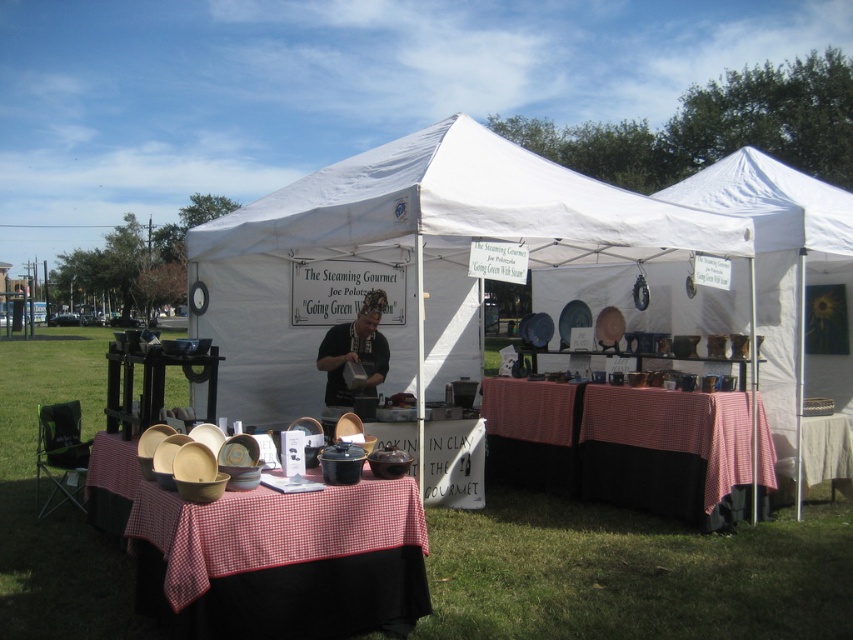
Between point (488, 228) and point (294, 600), which one is positioned in front?

Point (294, 600) is more forward.

Is white fabric tent at center taller than matte clay bowls at center?

Yes.

What do you see at coordinates (413, 253) in the screenshot? This screenshot has height=640, width=853. I see `white fabric tent at center` at bounding box center [413, 253].

This screenshot has width=853, height=640. Identify the location of white fabric tent at center. (413, 253).

Can you confirm if matte clay bowls at center is bigger than matte black shirt at center?

Indeed, matte clay bowls at center has a larger size compared to matte black shirt at center.

Is matte clay bowls at center further to camera compared to matte black shirt at center?

No, it is not.

Who is more distant from viewer, [341,596] or [372,412]?

Positioned behind is point [372,412].

Find the location of a particular element. matte clay bowls at center is located at coordinates (265, 554).

Looking at this image, which is above, white fabric tent at center or checkered fabric picnic table at center?

white fabric tent at center is higher up.

Is white fabric tent at center thinner than checkered fabric picnic table at center?

Incorrect, white fabric tent at center's width is not less than checkered fabric picnic table at center's.

Is point (219, 285) farther from viewer compared to point (556, 484)?

Yes, point (219, 285) is behind point (556, 484).

This screenshot has height=640, width=853. I want to click on white fabric tent at center, so click(x=413, y=253).